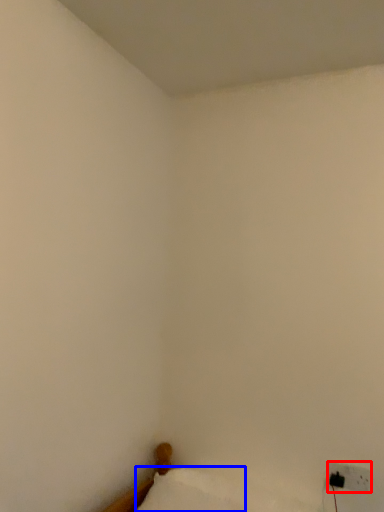
Question: Among these objects, which one is nearest to the camera, electric outlet (highlighted by a red box) or pillow (highlighted by a blue box)?

Choices:
 (A) electric outlet
 (B) pillow

Answer: (B)